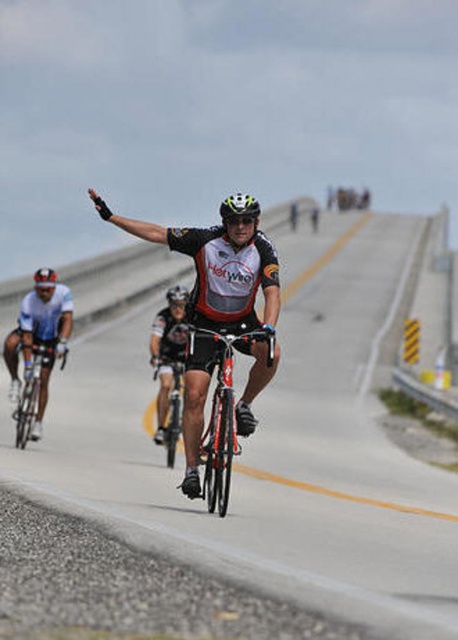
Looking at this image, who is taller, shiny black bicycle at center or white matte bicycle helmet at upper center?

Standing taller between the two is shiny black bicycle at center.

Which is in front, point (185, 360) or point (33, 278)?

Positioned in front is point (185, 360).

Describe the element at coordinates (218, 268) in the screenshot. I see `shiny black bicycle at center` at that location.

The image size is (458, 640). Find the location of `shiny black bicycle at center`. shiny black bicycle at center is located at coordinates (218, 268).

Does shiny black bicycle at center appear under white matte bicycle helmet at center?

Indeed, shiny black bicycle at center is positioned under white matte bicycle helmet at center.

Who is shorter, shiny black bicycle at center or white matte bicycle helmet at center?

white matte bicycle helmet at center

Between point (244, 275) and point (250, 196), which one is positioned behind?

The point (244, 275) is behind.

Find the location of a particular element. This screenshot has width=458, height=640. shiny black bicycle at center is located at coordinates (218, 268).

Can you confirm if shiny silver bicycle at left is bigger than white matte bicycle helmet at center?

Yes, shiny silver bicycle at left is bigger than white matte bicycle helmet at center.

Between shiny silver bicycle at left and white matte bicycle helmet at center, which one has less height?

white matte bicycle helmet at center

Where is `shiny silver bicycle at left`? shiny silver bicycle at left is located at coordinates click(34, 388).